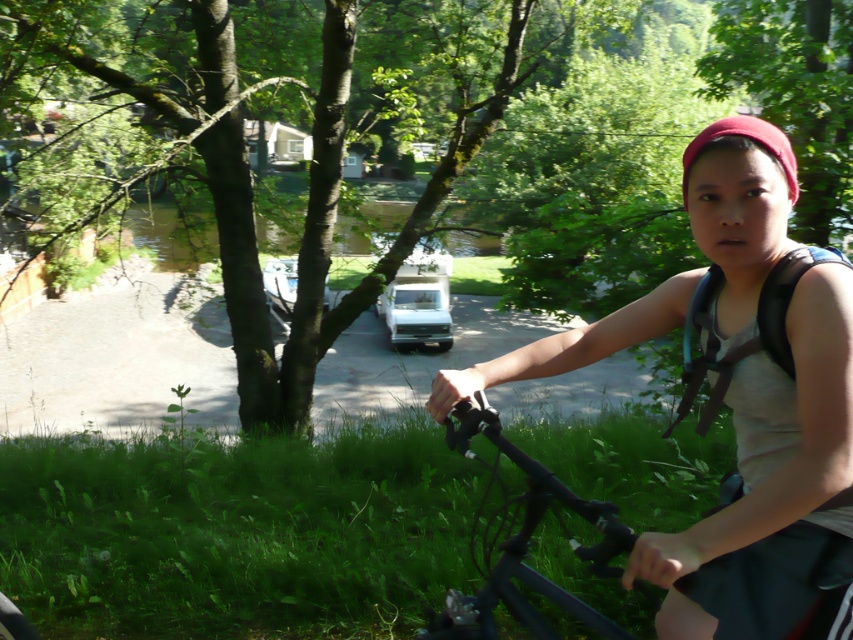
You are a photographer trying to capture the black matte bicycle at center and the black fabric strap at right in a single shot. Since both are black, you want to ensure they are distinguishable in your photo. Which object should you focus on to make sure it appears clearer in the image?

The black matte bicycle at center is closer to the viewer than the black fabric strap at right, so focusing on the black matte bicycle at center will ensure it appears clearer in the photo.

From the picture: You are standing on the sidewalk and see the matte gray tank top at center and the black matte bicycle at center. Which object is positioned to the right of the other?

The matte gray tank top at center is to the right of the black matte bicycle at center.

You are a photographer trying to capture the rider and their backpack straps in a photo. The camera can only focus on objects within a 6 inch range. Will both the matte gray tank top at center and the black fabric strap at right be in focus?

The matte gray tank top at center and the black fabric strap at right are 7.55 inches apart, which exceeds the camera focus range of 6 inches. Therefore, both objects cannot be in focus simultaneously.